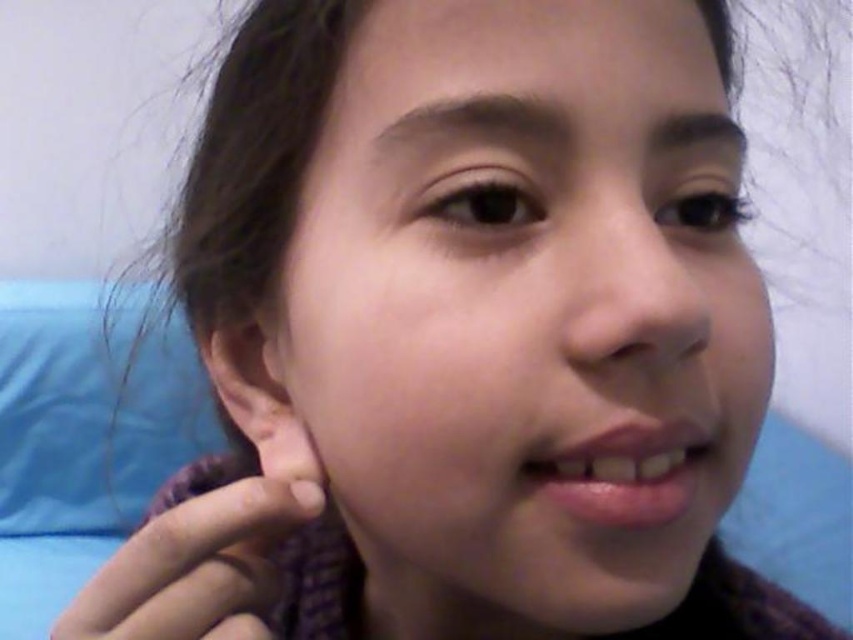
You are taking a photo of a person and need to adjust your focus. The smooth skin face at center and the blue fabric pillow at lower left are both in the frame. Which object is closer to you?

The smooth skin face at center is closer to the viewer than the blue fabric pillow at lower left, so you should focus on the smooth skin face at center.

You are a photographer adjusting the lighting for a portrait. You need to ensure that the light source is positioned so that it illuminates the point at coordinates point (x=524, y=314) without casting shadows on the smooth skin face at center. Based on the scene description, where should you place the light source relative to the subject?

The point (x=524, y=314) corresponds to the smooth skin face at center. To avoid casting shadows on the face, the light source should be placed directly in front of the subject, facing towards the center of their face.

Where is the smooth skin face at center located in the image?

The smooth skin face at center is located at the coordinates point [524,314].